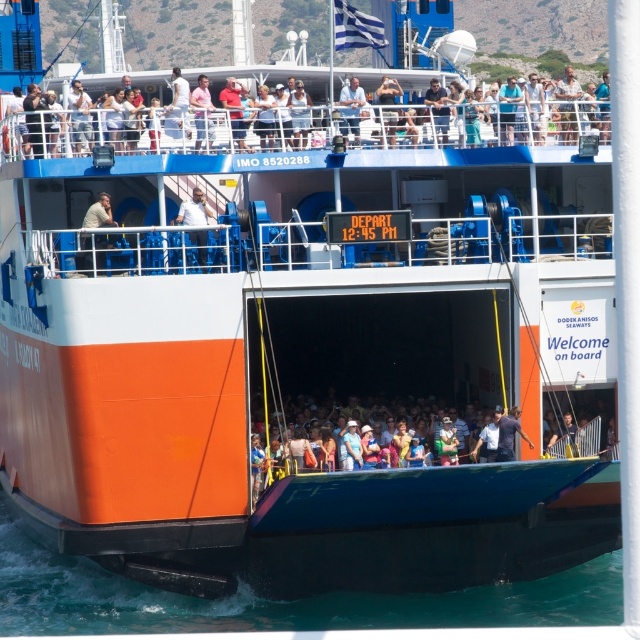
You are a photographer on the ferry and want to capture both the light blue fabric shirt at upper center and the light blue denim shirt at upper center in a single photo. Which shirt should you focus on to ensure both are in frame without moving the camera?

The light blue fabric shirt at upper center is shorter than the light blue denim shirt at upper center, so focusing on the taller light blue denim shirt at upper center will help ensure both are in frame.

Looking at this image, you are a photographer on the ferry and want to capture both the pink fabric shirt at upper center and the light blue denim shirt at upper center in the same frame. Given their sizes, which shirt will appear smaller in the photo?

The pink fabric shirt at upper center will appear smaller in the photo because it has a smaller size compared to the light blue denim shirt at upper center.